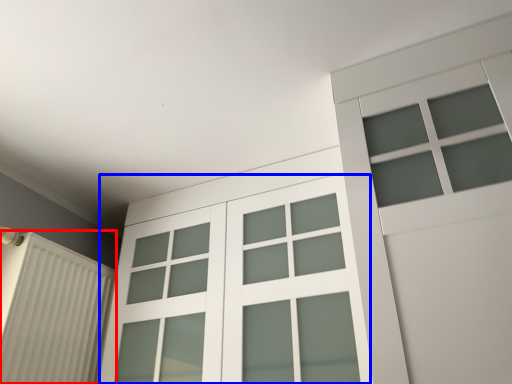
Question: Which of the following is the closest to the observer, shutter (highlighted by a red box) or glass door (highlighted by a blue box)?

Choices:
 (A) shutter
 (B) glass door

Answer: (B)